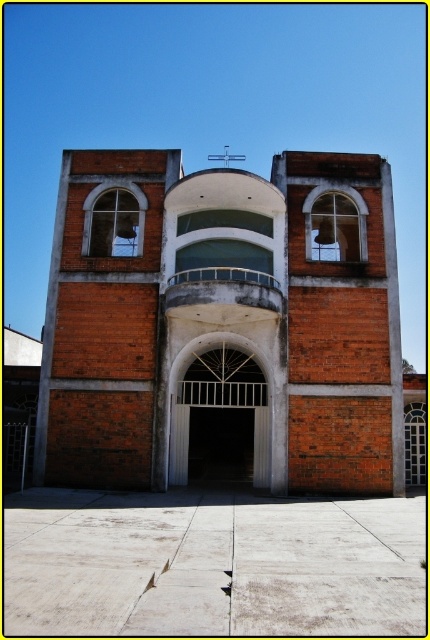
You are standing in front of the church and want to enter through the entrance. Which object should you approach first, the brick building at center or the white metal gate at center?

You should approach the white metal gate at center first because the brick building at center is to the left of it, meaning the gate is the entrance point leading into the building.

You are standing in front of the brick building at center and the white metal gate at center. If you want to paint both structures, which one will require more paint considering their height?

The brick building at center has a greater height compared to the white metal gate at center, so it will require more paint.